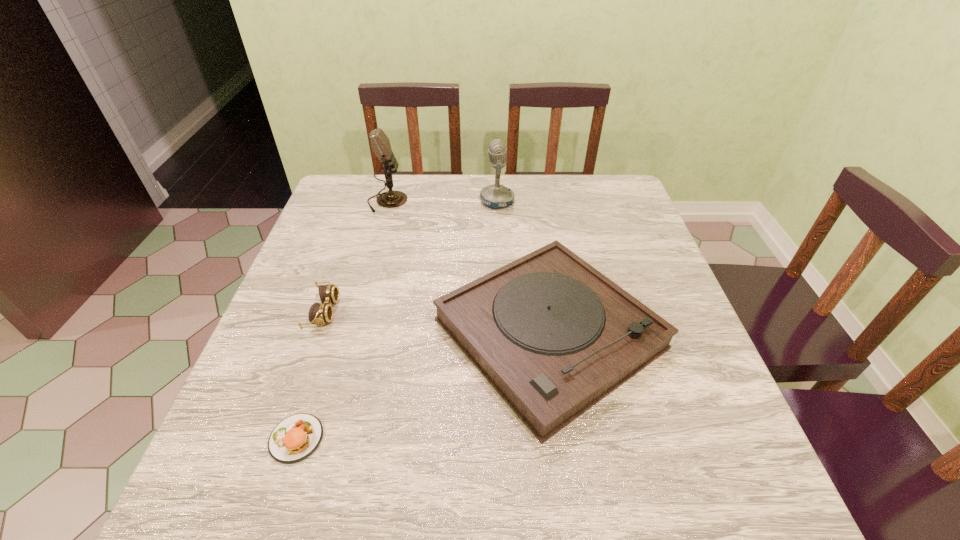
The image size is (960, 540). Find the location of `the left microphone`. the left microphone is located at coordinates (380, 143).

Locate an element on the screen. the right microphone is located at coordinates (494, 196).

Image resolution: width=960 pixels, height=540 pixels. I want to click on phonograph record, so point(553,336).

The image size is (960, 540). In order to click on the second shortest object in this screenshot , I will do `click(322, 313)`.

Identify the location of patty. This screenshot has height=540, width=960. (295, 438).

This screenshot has width=960, height=540. Identify the location of free space located on the front-facing side of the left microphone. (525, 201).

You are a GUI agent. You are given a task and a screenshot of the screen. Output one action in this format:
    pyautogui.click(x=<x>, y=<y>)
    Task: Click on the blank space located on the front-facing side of the right microphone
    
    Given the screenshot: What is the action you would take?
    pyautogui.click(x=396, y=201)

This screenshot has height=540, width=960. Find the location of `vacant space located 0.100m on the front-facing side of the right microphone`. vacant space located 0.100m on the front-facing side of the right microphone is located at coordinates (446, 201).

At what (x,y) coordinates should I click in order to perform the action: click on vacant point located on the front-facing side of the right microphone. Please return your answer as a coordinate pair (x, y). Looking at the image, I should click on (345, 201).

Identify the location of blank space located on the back of the phonograph record. (531, 209).